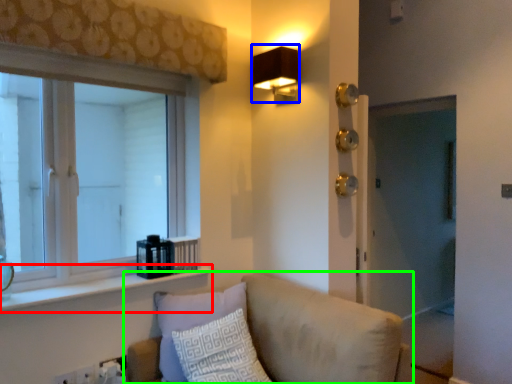
Question: Estimate the real-world distances between objects in this image. Which object is farther from window sill (highlighted by a red box), fixture (highlighted by a blue box) or studio couch (highlighted by a green box)?

Choices:
 (A) fixture
 (B) studio couch

Answer: (A)